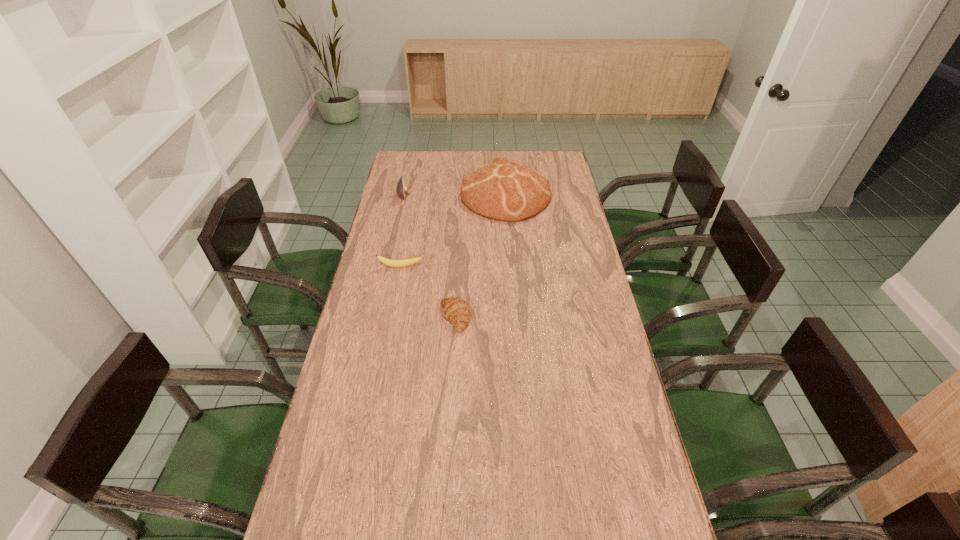
Identify the location of bread. Image resolution: width=960 pixels, height=540 pixels. (506, 191).

Locate an element on the screen. The image size is (960, 540). the third shortest object is located at coordinates (401, 189).

Identify the location of crescent roll. Image resolution: width=960 pixels, height=540 pixels. (455, 310).

Locate an element on the screen. the second nearest object is located at coordinates (405, 262).

Locate an element on the screen. The width and height of the screenshot is (960, 540). vacant space situated 0.130m on the front of the tallest object is located at coordinates [x=509, y=242].

Where is `free spot located on the seed side of the third shortest object`? free spot located on the seed side of the third shortest object is located at coordinates (442, 195).

Where is `free location located 0.260m on the left of the nearest object`? free location located 0.260m on the left of the nearest object is located at coordinates (362, 318).

The image size is (960, 540). Find the location of `blank space located 0.340m on the upward curve of the second nearest object`. blank space located 0.340m on the upward curve of the second nearest object is located at coordinates 386,342.

You are a GUI agent. You are given a task and a screenshot of the screen. Output one action in this format:
    pyautogui.click(x=<x>, y=<y>)
    Task: Click on the object at the far edge
    The width and height of the screenshot is (960, 540).
    Given the screenshot: What is the action you would take?
    pyautogui.click(x=506, y=191)

Where is `avocado located at the left edge`? The height and width of the screenshot is (540, 960). avocado located at the left edge is located at coordinates (401, 189).